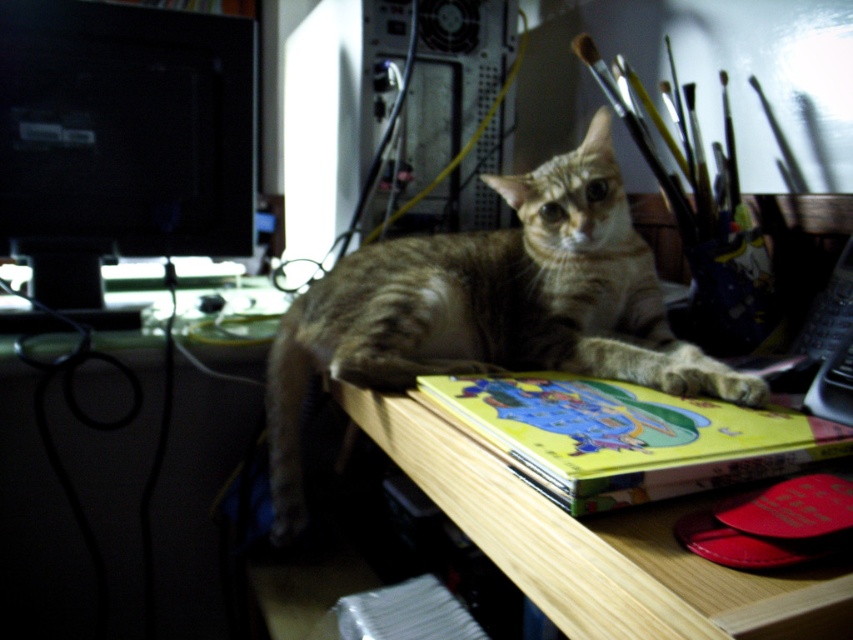
From the picture: You are standing 1.18 meters away from the point at coordinates (149,228). If you want to place a small vase there, will it fit without overlapping other items?

The point at coordinates (149,228) is exactly 1.18 meters away from you. Since there are no other items mentioned at that location, placing a small vase there should be possible without overlapping anything.

You are an interior designer assessing the space in the image. You need to ensure that the tabby fur cat at center and the matte plastic computer desk at lower left are positioned for optimal comfort and safety. Based on their sizes, which object should be placed lower to the ground to accommodate the other?

The matte plastic computer desk at lower left should be placed lower to the ground since the tabby fur cat at center is taller than it, ensuring the cat can comfortably reach or navigate around the desk.

Based on the photo, you are an office worker who needs to place a new keyboard on the desk. The keyboard requires 15 cm of space. The tabby fur cat at center is currently occupying space on the matte plastic computer desk at lower left. Can the keyboard be placed on the desk without disturbing the cat?

The tabby fur cat at center is to the right of the matte plastic computer desk at lower left, but the exact available space isn t specified. However, since the cat is occupying part of the desk, there might still be enough room for the keyboard if the desk is large enough. Without specific measurements, it s uncertain, but the cat s position to the right could leave space on the left side for the keyboard.